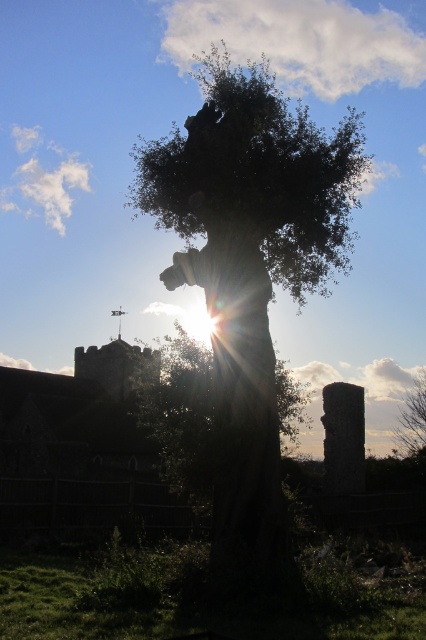
What do you see at coordinates (250, 278) in the screenshot?
I see `dark green leafy tree at center` at bounding box center [250, 278].

How distant is dark green leafy tree at center from green leafy tree at center?

A distance of 68.33 meters exists between dark green leafy tree at center and green leafy tree at center.

Between point (336, 170) and point (412, 429), which one is positioned behind?

The point (412, 429) is behind.

Find the location of `dark green leafy tree at center`. dark green leafy tree at center is located at coordinates (250, 278).